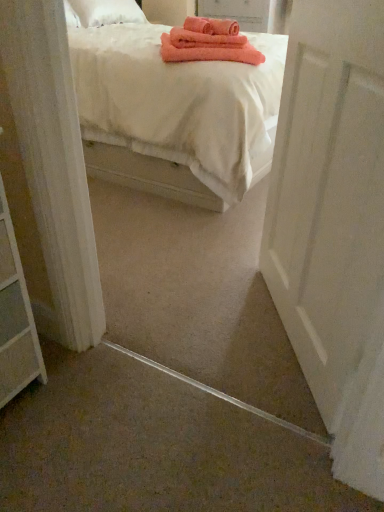
Find the location of `free space to the left of white matte door at right`. free space to the left of white matte door at right is located at coordinates (200, 314).